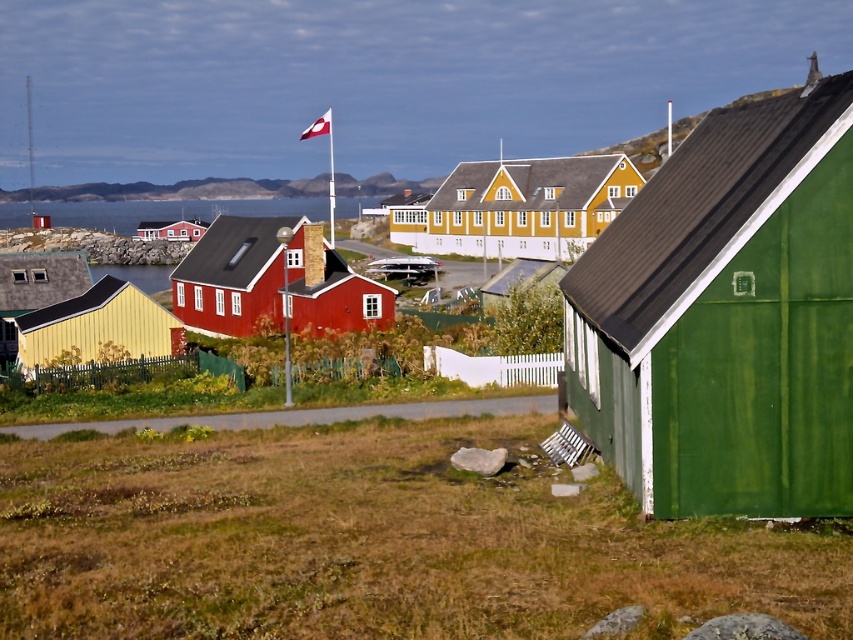
You are a tourist visiting this coastal village and want to take a photo of the green matte wood hut at right and the transparent water at center. Which object should you focus on first if you want to capture both in a single shot without moving the camera?

The green matte wood hut at right has a smaller size compared to transparent water at center, so you should focus on the transparent water at center first as it occupies more of the frame, allowing the smaller hut to fit naturally within the shot.

You are a tourist standing in the grassy area near the white picket fence. You see the green matte wood hut at right and the matte yellow hut at left. Which one has a higher roofline?

The green matte wood hut at right has a higher roofline because it is taller than the matte yellow hut at left.

You are standing at the point with coordinates point (120,205) and want to walk to the point with coordinates point (757,328). According to the scene, will you be moving towards or away from the cluster of colorful houses?

Since point (757,328) is in front of point (120,205), moving from point (120,205) to point (757,328) means you are moving towards the cluster of colorful houses because the houses are located in the foreground area where the first point is situated.